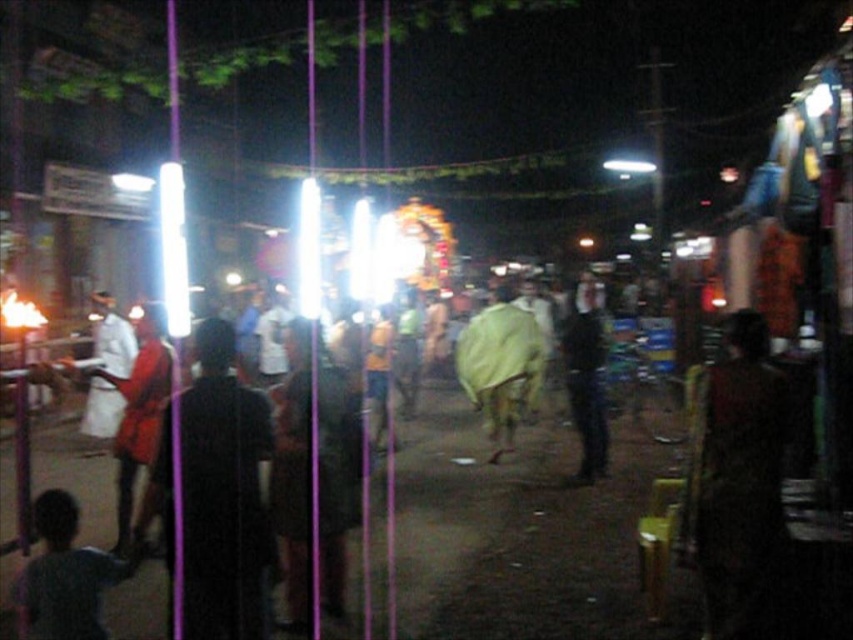
You are a photographer who wants to capture the dark brown textured shirt at center in your photo. The camera is focused at point [738,484]. Is the dark brown textured shirt at center in focus?

Yes, the point [738,484] corresponds to the dark brown textured shirt at center, so the dark brown textured shirt at center is in focus.

You are a delivery person carrying a package and need to navigate through the crowd in the image. The yellow fabric at center is part of a vendor stall, and the black matte jacket at center belongs to a customer. Can you safely pass between them without getting too close?

The distance between the yellow fabric at center and the black matte jacket at center is 5.68 feet, which is sufficient for a delivery person to pass safely without getting too close.